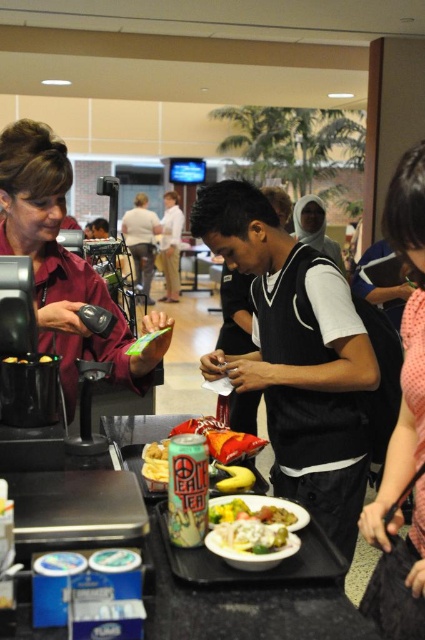
You are a customer at the counter and want to place your pink dotted dress at right and yellow matte banana at center on the counter. Which item should you place first to ensure proper positioning?

The yellow matte banana at center should be placed first because the pink dotted dress at right needs to be on its right side.

Based on the photo, you are a customer standing at the counter and want to know if the matte maroon shirt at left and the pink dotted dress at right are overlapping. Based on their positions, can you determine if one is covering part of the other?

The matte maroon shirt at left might be wider than pink dotted dress at right, so there could be an overlap where the matte maroon shirt at left extends over the pink dotted dress at right.